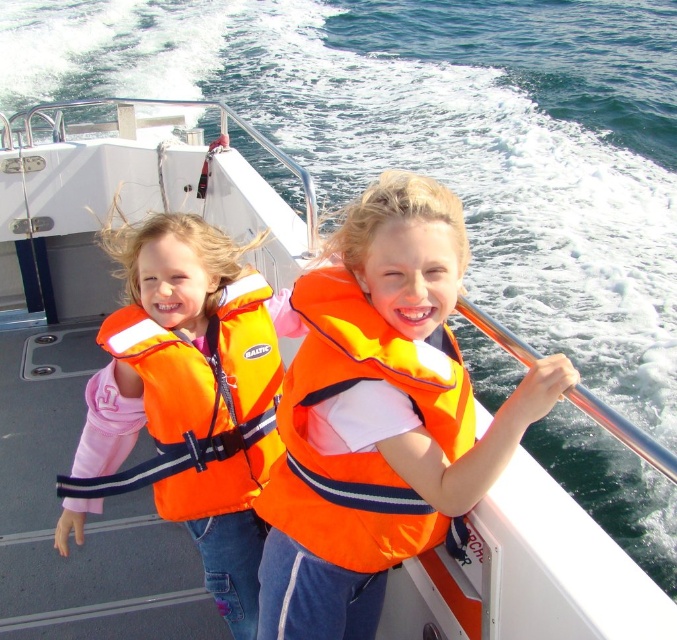
Question: Is the position of orange life vest at left less distant than that of orange fabric life vest at center?

Choices:
 (A) yes
 (B) no

Answer: (B)

Question: Which point is closer to the camera?

Choices:
 (A) (372, 276)
 (B) (263, 492)
 (C) (165, 516)

Answer: (A)

Question: Which point is farther from the camera taking this photo?

Choices:
 (A) (181, 438)
 (B) (565, 378)
 (C) (165, 422)
 (D) (292, 292)

Answer: (A)

Question: Does orange life vest at center have a lesser width compared to orange fabric life jacket at left?

Choices:
 (A) no
 (B) yes

Answer: (B)

Question: Which object appears farthest from the camera in this image?

Choices:
 (A) orange life vest at center
 (B) orange life vest at left

Answer: (B)

Question: Can you confirm if orange life vest at center is thinner than orange fabric life jacket at left?

Choices:
 (A) yes
 (B) no

Answer: (A)